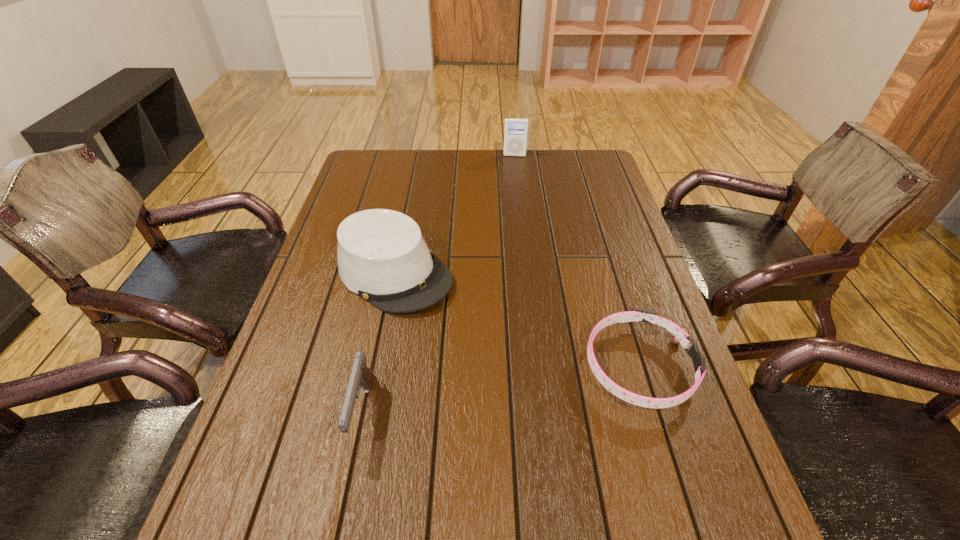
This screenshot has width=960, height=540. I want to click on vacant spot on the desktop that is between the pistol and the shortest object and is positioned on the front-facing side of the second farthest object, so click(x=546, y=381).

Locate an element on the screen. vacant spot on the desktop that is between the pistol and the dog collar and is positioned on the front-facing side of the farthest object is located at coordinates (507, 388).